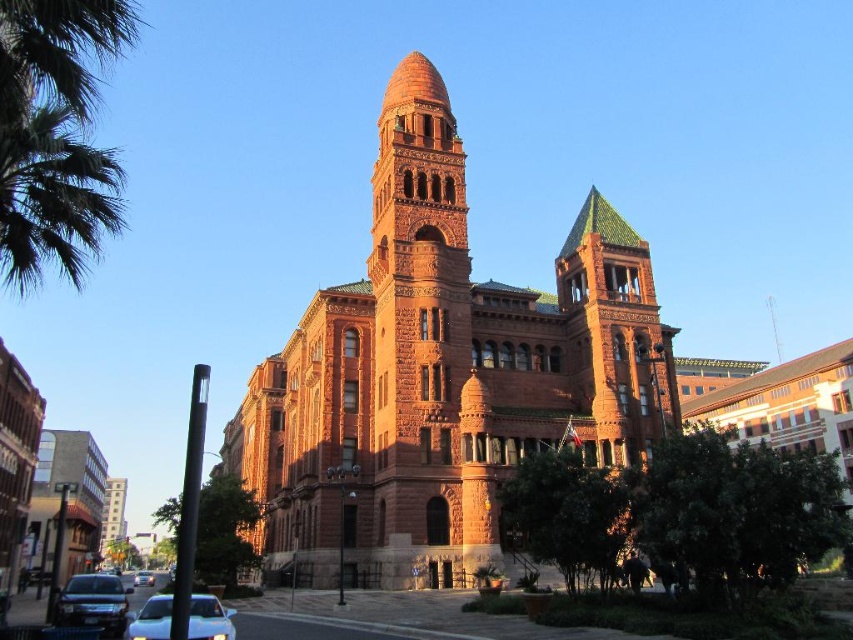
Question: Which point is farther to the camera?

Choices:
 (A) (97, 624)
 (B) (149, 573)
 (C) (195, 602)
 (D) (403, 188)

Answer: (B)

Question: Considering the real-world distances, which object is closest to the white glossy car at lower left?

Choices:
 (A) shiny black sedan at lower left
 (B) reddish-brown stone bell tower at center

Answer: (A)

Question: Is reddish-brown stone bell tower at center thinner than white glossy car at lower left?

Choices:
 (A) no
 (B) yes

Answer: (A)

Question: Considering the real-world distances, which object is farthest from the white glossy car at center?

Choices:
 (A) reddish-brown stone bell tower at center
 (B) shiny black sedan at lower left
 (C) reddish-brown stone church at center

Answer: (A)

Question: Is green leafy palm tree at upper left wider than white glossy car at lower left?

Choices:
 (A) no
 (B) yes

Answer: (B)

Question: Can you confirm if reddish-brown stone bell tower at center is thinner than shiny black sedan at lower left?

Choices:
 (A) yes
 (B) no

Answer: (A)